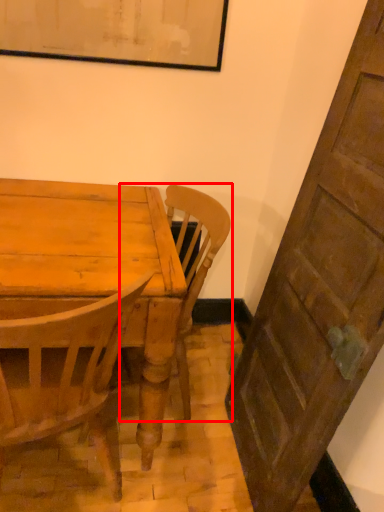
Question: From the image's perspective, what is the correct spatial positioning of chair (annotated by the red box) in reference to table top?

Choices:
 (A) below
 (B) above

Answer: (B)